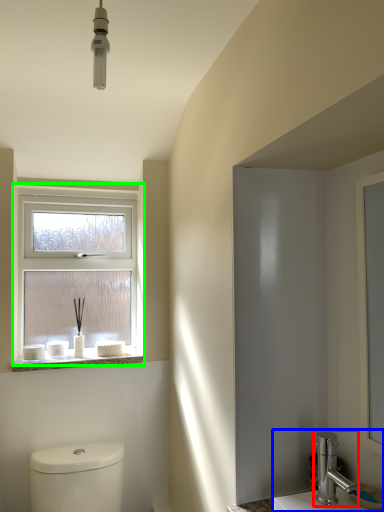
Question: Which object is positioned farthest from tap (highlighted by a red box)? Select from sink (highlighted by a blue box) and window (highlighted by a green box).

Choices:
 (A) sink
 (B) window

Answer: (B)